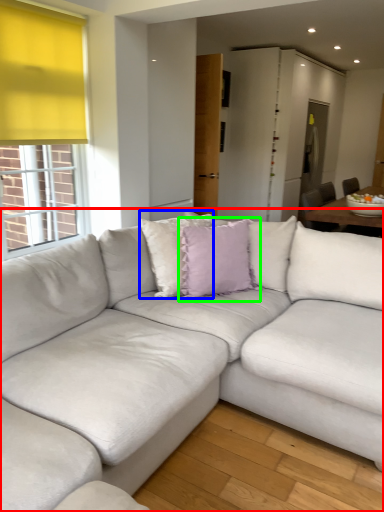
Question: Estimate the real-world distances between objects in this image. Which object is farther from studio couch (highlighted by a red box), pillow (highlighted by a blue box) or pillow (highlighted by a green box)?

Choices:
 (A) pillow
 (B) pillow

Answer: (A)